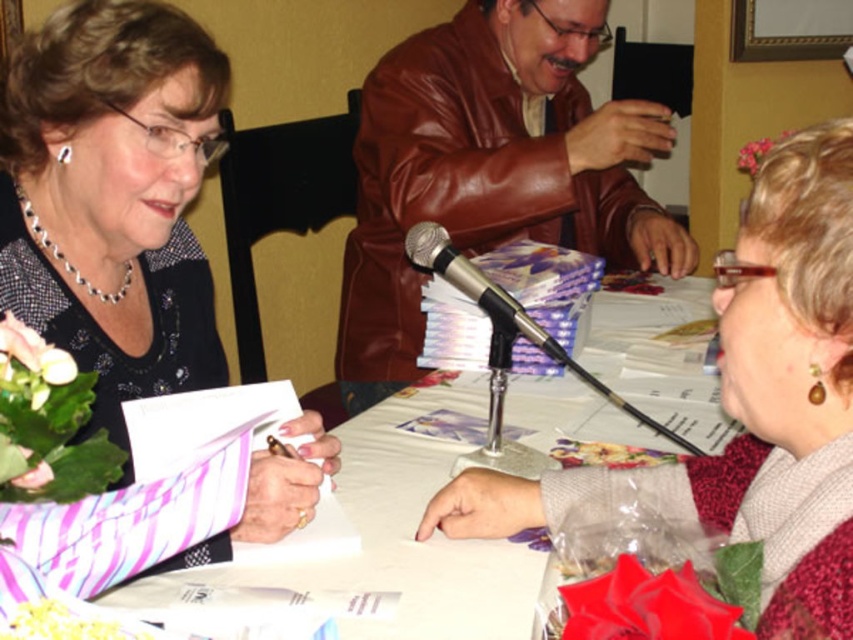
You are organizing a book signing event and need to place a name tag on the table. The name tag is 10 cm wide. There is a brown leather jacket at center and a white paper at center on the table. Can the name tag fit between them without overlapping either?

The brown leather jacket at center might be wider than the white paper at center. Since the name tag is 10 cm wide, it depends on the actual width of the jacket and paper. If the space between them is at least 10 cm, it can fit. However, without exact measurements, we cannot confirm for certain.

Consider the image. You are organizing a book signing event and need to place a matte black card at center and a matte brown jacket at center on a table. Given their sizes, which object should be placed first to ensure both fit on the table?

The matte brown jacket at center should be placed first because it is smaller in width than the matte black card at center, allowing more space for the larger card to be placed afterward.